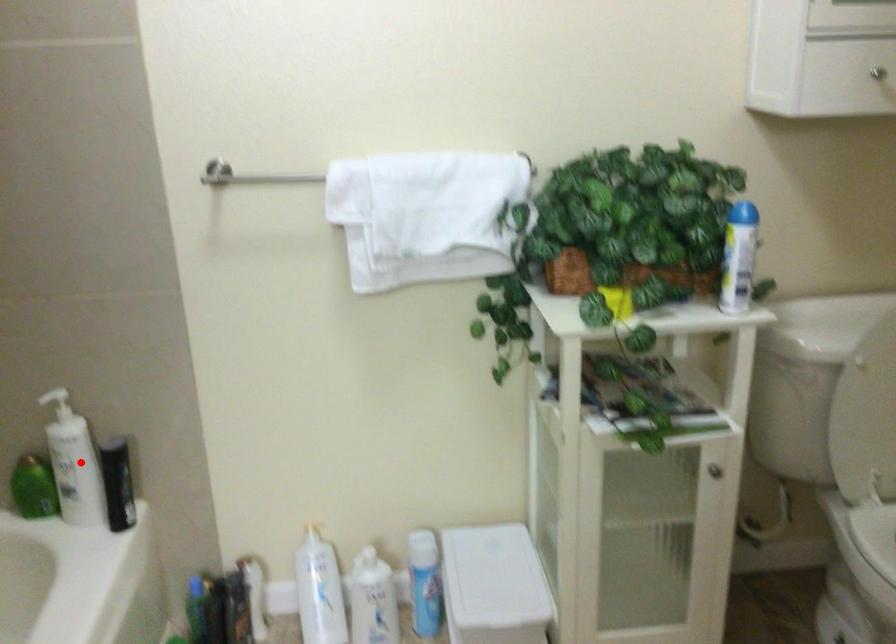
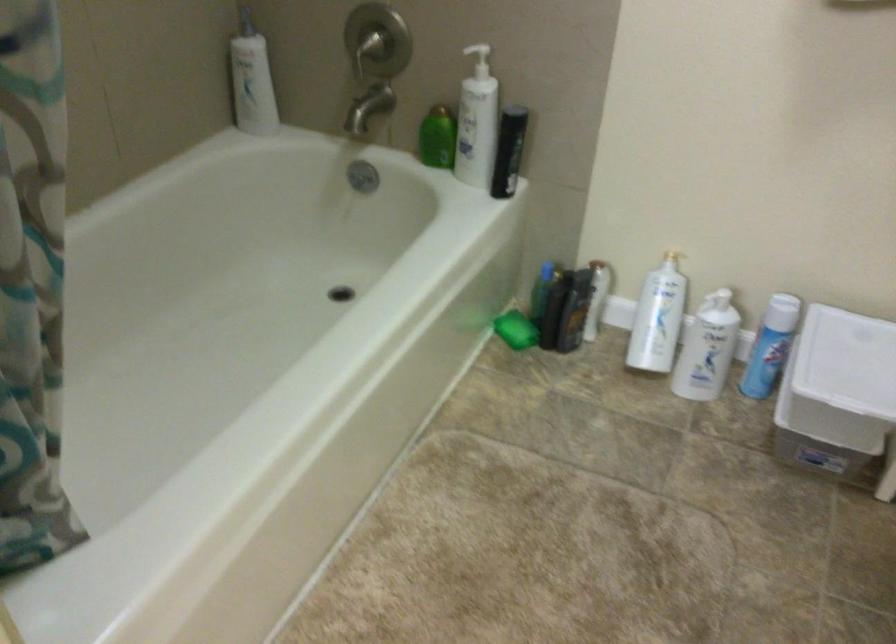
Locate, in the second image, the point that corresponds to the highlighted location in the first image.

(477, 122)